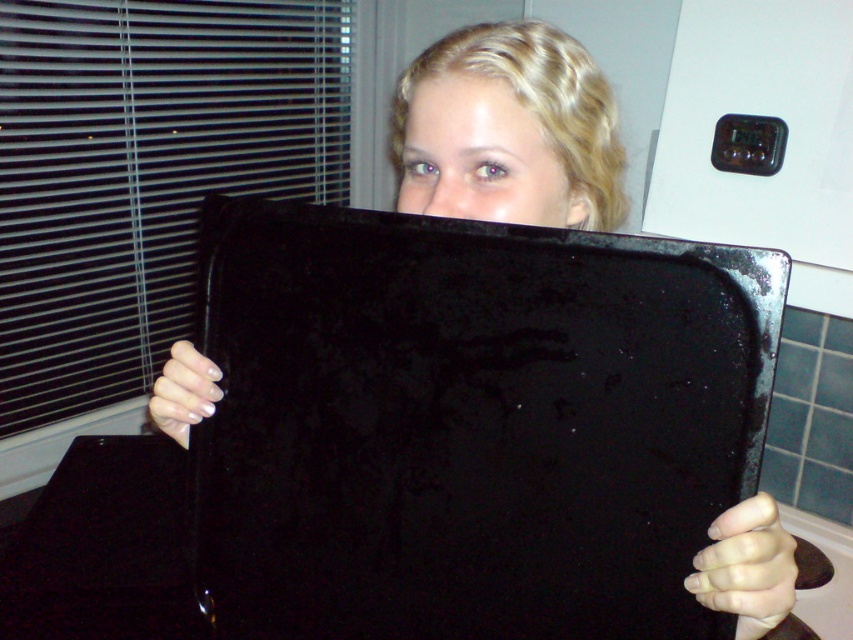
Question: Which object is positioned closest to the matte black tray at center?

Choices:
 (A) matte black face at upper center
 (B) black matte blind at left

Answer: (A)

Question: Which is nearer to the black matte blind at left?

Choices:
 (A) matte black face at upper center
 (B) matte black tray at center

Answer: (A)

Question: Does black matte blind at left appear on the right side of matte black tray at center?

Choices:
 (A) no
 (B) yes

Answer: (A)

Question: Is black matte blind at left to the left of matte black tray at center from the viewer's perspective?

Choices:
 (A) no
 (B) yes

Answer: (B)

Question: Among these objects, which one is farthest from the camera?

Choices:
 (A) matte black tray at center
 (B) matte black face at upper center
 (C) black matte blind at left

Answer: (C)

Question: Does black matte blind at left appear over matte black tray at center?

Choices:
 (A) no
 (B) yes

Answer: (B)